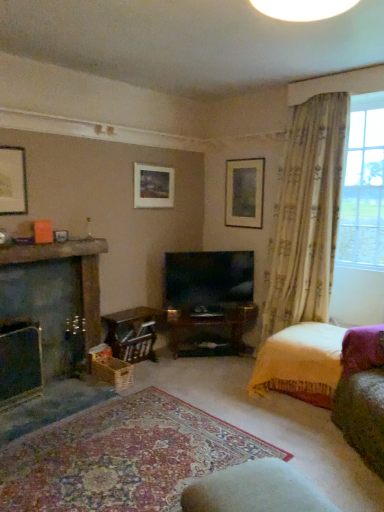
Question: Can you confirm if matte gold picture frame at upper center, the second picture frame when ordered from right to left, is taller than matte black picture frame at upper left, the first picture frame when ordered from left to right?

Choices:
 (A) yes
 (B) no

Answer: (B)

Question: Is the depth of matte gold picture frame at upper center, the second picture frame when ordered from right to left, greater than that of matte black picture frame at upper left, the 3th picture frame from the back?

Choices:
 (A) yes
 (B) no

Answer: (A)

Question: From a real-world perspective, is matte gold picture frame at upper center, arranged as the second picture frame when viewed from the left, below matte black picture frame at upper left, the 3th picture frame in the right-to-left sequence?

Choices:
 (A) yes
 (B) no

Answer: (A)

Question: Is matte gold picture frame at upper center, arranged as the second picture frame when viewed from the left, directly adjacent to matte black picture frame at upper left, the 3th picture frame in the right-to-left sequence?

Choices:
 (A) yes
 (B) no

Answer: (B)

Question: Does matte gold picture frame at upper center, the second picture frame when ordered from right to left, have a lesser height compared to matte black picture frame at upper left, the first picture frame when ordered from left to right?

Choices:
 (A) yes
 (B) no

Answer: (A)

Question: Considering the positions of point (89, 330) and point (377, 156), is point (89, 330) closer or farther from the camera than point (377, 156)?

Choices:
 (A) closer
 (B) farther

Answer: (B)

Question: Based on their sizes in the image, would you say dark gray stone fireplace at left, the 2th fireplace viewed from the front, is bigger or smaller than translucent floral curtains at right?

Choices:
 (A) big
 (B) small

Answer: (B)

Question: In the image, is dark gray stone fireplace at left, which appears as the 1th fireplace when viewed from the back, positioned in front of or behind translucent floral curtains at right?

Choices:
 (A) front
 (B) behind

Answer: (A)

Question: Based on their positions, is dark gray stone fireplace at left, the 2th fireplace viewed from the front, located to the left or right of translucent floral curtains at right?

Choices:
 (A) right
 (B) left

Answer: (B)

Question: In the image, is wooden crate at lower center positioned in front of or behind matte gold picture frame at upper center, positioned as the second picture frame in back-to-front order?

Choices:
 (A) front
 (B) behind

Answer: (A)

Question: In the image, is wooden crate at lower center on the left side or the right side of matte gold picture frame at upper center, positioned as the second picture frame in back-to-front order?

Choices:
 (A) left
 (B) right

Answer: (A)

Question: Would you say wooden crate at lower center is inside or outside matte gold picture frame at upper center, the second picture frame when ordered from right to left?

Choices:
 (A) inside
 (B) outside

Answer: (B)

Question: Is point (127, 344) closer or farther from the camera than point (142, 168)?

Choices:
 (A) farther
 (B) closer

Answer: (B)

Question: Is point (253, 185) positioned closer to the camera than point (182, 270)?

Choices:
 (A) farther
 (B) closer

Answer: (A)

Question: Is matte wooden picture frame at upper center, acting as the 3th picture frame starting from the front, inside or outside of flat-screen tv at center?

Choices:
 (A) inside
 (B) outside

Answer: (B)